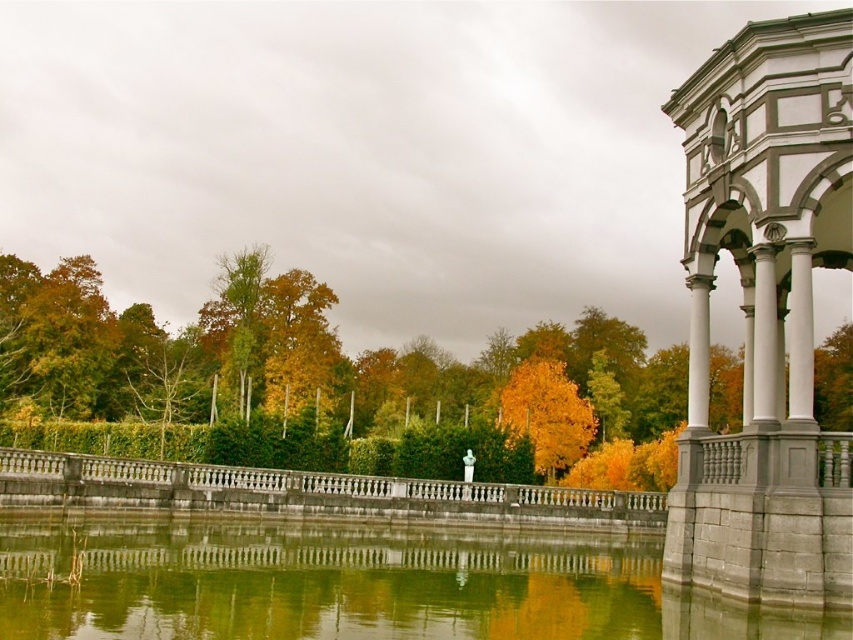
Question: In this image, where is gray stone gazebo at right located relative to yellow leafy tree at center?

Choices:
 (A) left
 (B) right

Answer: (B)

Question: Estimate the real-world distances between objects in this image. Which object is farther from the gray stone gazebo at right?

Choices:
 (A) yellow-green leaves at center
 (B) yellow leafy tree at center

Answer: (A)

Question: Which point is farther from the camera taking this photo?

Choices:
 (A) (201, 563)
 (B) (758, 64)
 (C) (263, 288)

Answer: (C)

Question: Which object is positioned closest to the yellow-green leaves at center?

Choices:
 (A) gray stone gazebo at right
 (B) green reflective water at center

Answer: (B)

Question: Can you confirm if gray stone gazebo at right is positioned to the right of yellow leafy tree at center?

Choices:
 (A) yes
 (B) no

Answer: (A)

Question: Is yellow-green leaves at center to the left of yellow leafy tree at center from the viewer's perspective?

Choices:
 (A) yes
 (B) no

Answer: (A)